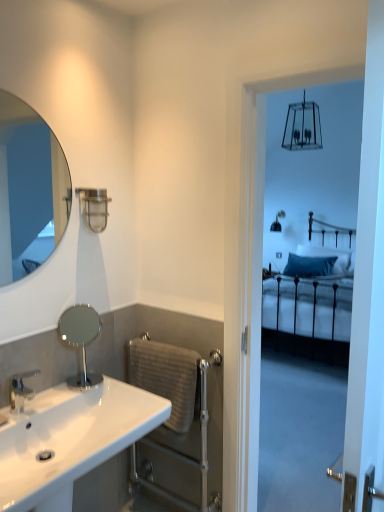
The width and height of the screenshot is (384, 512). What do you see at coordinates (20, 390) in the screenshot?
I see `silver metallic faucet at lower left` at bounding box center [20, 390].

Find the location of `satin nickel shower at upper left`. satin nickel shower at upper left is located at coordinates (94, 208).

Describe the element at coordinates (184, 459) in the screenshot. I see `silver metallic towel rail at lower center` at that location.

Where is `silver metallic towel rail at lower center`? This screenshot has height=512, width=384. silver metallic towel rail at lower center is located at coordinates (184, 459).

The width and height of the screenshot is (384, 512). What are the coordinates of `matte silver mirror at upper left, the 2th mirror ordered from the bottom` in the screenshot? It's located at (29, 190).

From the picture: Which object is positioned more to the left, silver metallic towel rail at lower center or polished chrome mirror at center, which ranks as the 2th mirror in top-to-bottom order?

polished chrome mirror at center, which ranks as the 2th mirror in top-to-bottom order, is more to the left.

Considering the sizes of objects silver metallic towel rail at lower center and polished chrome mirror at center, which ranks as the 2th mirror in top-to-bottom order, in the image provided, who is wider, silver metallic towel rail at lower center or polished chrome mirror at center, which ranks as the 2th mirror in top-to-bottom order,?

Wider between the two is silver metallic towel rail at lower center.

Is silver metallic towel rail at lower center further to the viewer compared to polished chrome mirror at center, which ranks as the 2th mirror in top-to-bottom order?

Yes.

Are silver metallic towel rail at lower center and polished chrome mirror at center, which ranks as the 2th mirror in top-to-bottom order, far apart?

No, silver metallic towel rail at lower center is not far from polished chrome mirror at center, which ranks as the 2th mirror in top-to-bottom order.

Is polished chrome mirror at center, which appears as the first mirror when ordered from the bottom, far from white glossy sink at lower left?

No, polished chrome mirror at center, which appears as the first mirror when ordered from the bottom, is in close proximity to white glossy sink at lower left.

Between polished chrome mirror at center, which ranks as the 2th mirror in top-to-bottom order, and white glossy sink at lower left, which one has smaller size?

With smaller size is polished chrome mirror at center, which ranks as the 2th mirror in top-to-bottom order.

Which is more to the left, polished chrome mirror at center, which appears as the first mirror when ordered from the bottom, or white glossy sink at lower left?

white glossy sink at lower left is more to the left.

What's the angular difference between polished chrome mirror at center, which appears as the first mirror when ordered from the bottom, and white glossy sink at lower left's facing directions?

1.82 degrees.

Does point (86, 376) come farther from viewer compared to point (331, 265)?

No, (86, 376) is closer to viewer.

Which of these two, polished chrome mirror at center, which appears as the first mirror when ordered from the bottom, or blue velvet pillow at center, is wider?

blue velvet pillow at center is wider.

Can you tell me how much polished chrome mirror at center, which appears as the first mirror when ordered from the bottom, and blue velvet pillow at center differ in facing direction?

polished chrome mirror at center, which appears as the first mirror when ordered from the bottom, and blue velvet pillow at center are facing 85 degrees away from each other.

From a real-world perspective, is polished chrome mirror at center, which ranks as the 2th mirror in top-to-bottom order, above or below blue velvet pillow at center?

Clearly, from a real-world perspective, polished chrome mirror at center, which ranks as the 2th mirror in top-to-bottom order, is above blue velvet pillow at center.

Which is correct: silver metallic faucet at lower left is inside satin nickel shower at upper left, or outside of it?

silver metallic faucet at lower left lies outside satin nickel shower at upper left.

From a real-world perspective, is silver metallic faucet at lower left physically located above or below satin nickel shower at upper left?

From a real-world perspective, silver metallic faucet at lower left is physically below satin nickel shower at upper left.

Considering the relative positions of silver metallic faucet at lower left and satin nickel shower at upper left in the image provided, is silver metallic faucet at lower left to the left of satin nickel shower at upper left from the viewer's perspective?

Indeed, silver metallic faucet at lower left is positioned on the left side of satin nickel shower at upper left.

Which of these two, silver metallic faucet at lower left or satin nickel shower at upper left, stands shorter?

silver metallic faucet at lower left.

From a real-world perspective, is polished chrome mirror at center, which appears as the first mirror when ordered from the bottom, positioned over gray textured towel bar at lower center based on gravity?

Indeed, from a real-world perspective, polished chrome mirror at center, which appears as the first mirror when ordered from the bottom, stands above gray textured towel bar at lower center.

Based on their positions, is polished chrome mirror at center, which appears as the first mirror when ordered from the bottom, located to the left or right of gray textured towel bar at lower center?

polished chrome mirror at center, which appears as the first mirror when ordered from the bottom, is positioned on gray textured towel bar at lower center's left side.

Considering the relative sizes of polished chrome mirror at center, which ranks as the 2th mirror in top-to-bottom order, and gray textured towel bar at lower center in the image provided, is polished chrome mirror at center, which ranks as the 2th mirror in top-to-bottom order, bigger than gray textured towel bar at lower center?

Actually, polished chrome mirror at center, which ranks as the 2th mirror in top-to-bottom order, might be smaller than gray textured towel bar at lower center.

What's the angular difference between polished chrome mirror at center, which ranks as the 2th mirror in top-to-bottom order, and gray textured towel bar at lower center's facing directions?

90.4 degrees.

Looking at their sizes, would you say silver metallic faucet at lower left is wider or thinner than blue velvet pillow at center?

silver metallic faucet at lower left is thinner than blue velvet pillow at center.

In the scene shown: Which of these two, silver metallic faucet at lower left or blue velvet pillow at center, stands shorter?

silver metallic faucet at lower left.

Relative to blue velvet pillow at center, is silver metallic faucet at lower left in front or behind?

silver metallic faucet at lower left is positioned closer to the viewer than blue velvet pillow at center.

This screenshot has height=512, width=384. In order to click on pillow on the right side of silver metallic faucet at lower left in this screenshot , I will do pyautogui.click(x=309, y=266).

From the picture: Is silver metallic towel rail at lower center beside silver metallic faucet at lower left?

No, silver metallic towel rail at lower center is not touching silver metallic faucet at lower left.

Which is further, (182, 458) or (24, 376)?

The point (182, 458) is more distant.

Considering the sizes of objects silver metallic towel rail at lower center and silver metallic faucet at lower left in the image provided, who is taller, silver metallic towel rail at lower center or silver metallic faucet at lower left?

With more height is silver metallic towel rail at lower center.

Between silver metallic towel rail at lower center and silver metallic faucet at lower left, which one has larger width?

With larger width is silver metallic faucet at lower left.

At what (x,y) coordinates should I click in order to perform the action: click on mirror that is the 1st object to the left of the silver metallic towel rail at lower center, starting at the anchor. Please return your answer as a coordinate pair (x, y). This screenshot has height=512, width=384. Looking at the image, I should click on (80, 340).

Identify the location of mirror on the right of white glossy sink at lower left. (80, 340).

Which object lies nearer to the anchor point silver metallic faucet at lower left, matte silver mirror at upper left, marked as the 1th mirror in a top-to-bottom arrangement, or blue velvet pillow at center?

matte silver mirror at upper left, marked as the 1th mirror in a top-to-bottom arrangement, is closer to silver metallic faucet at lower left.

Based on the photo, estimate the real-world distances between objects in this image. Which object is further from silver metallic towel rail at lower center, blue velvet pillow at center or matte silver mirror at upper left, the 2th mirror ordered from the bottom?

blue velvet pillow at center is positioned further to the anchor silver metallic towel rail at lower center.

Which object lies nearer to the anchor point silver metallic towel rail at lower center, polished chrome mirror at center, which ranks as the 2th mirror in top-to-bottom order, or satin nickel shower at upper left?

The object closer to silver metallic towel rail at lower center is polished chrome mirror at center, which ranks as the 2th mirror in top-to-bottom order.

Based on their spatial positions, is blue velvet pillow at center or silver metallic faucet at lower left closer to matte silver mirror at upper left, the 2th mirror ordered from the bottom?

silver metallic faucet at lower left.

Considering their positions, is silver metallic faucet at lower left positioned closer to blue velvet pillow at center than polished chrome mirror at center, which ranks as the 2th mirror in top-to-bottom order?

Based on the image, polished chrome mirror at center, which ranks as the 2th mirror in top-to-bottom order, appears to be nearer to blue velvet pillow at center.

Considering their positions, is matte silver mirror at upper left, marked as the 1th mirror in a top-to-bottom arrangement, positioned further to gray textured towel bar at lower center than satin nickel shower at upper left?

matte silver mirror at upper left, marked as the 1th mirror in a top-to-bottom arrangement, lies further to gray textured towel bar at lower center than the other object.

From the image, which object appears to be farther from gray textured towel bar at lower center, satin nickel shower at upper left or silver metallic faucet at lower left?

Among the two, satin nickel shower at upper left is located further to gray textured towel bar at lower center.

From the picture: When comparing their distances from blue velvet pillow at center, does satin nickel shower at upper left or white glossy sink at lower left seem further?

white glossy sink at lower left lies further to blue velvet pillow at center than the other object.

Where is `shower positioned between white glossy sink at lower left and blue velvet pillow at center from near to far`? shower positioned between white glossy sink at lower left and blue velvet pillow at center from near to far is located at coordinates (94, 208).

Where is `mirror between matte silver mirror at upper left, the 2th mirror ordered from the bottom, and white glossy sink at lower left in the up-down direction`? mirror between matte silver mirror at upper left, the 2th mirror ordered from the bottom, and white glossy sink at lower left in the up-down direction is located at coordinates (80, 340).

Identify the location of sink that lies between satin nickel shower at upper left and silver metallic towel rail at lower center from top to bottom. The image size is (384, 512). (70, 440).

Locate an element on the screen. mirror between matte silver mirror at upper left, the 2th mirror ordered from the bottom, and silver metallic faucet at lower left from top to bottom is located at coordinates [80, 340].